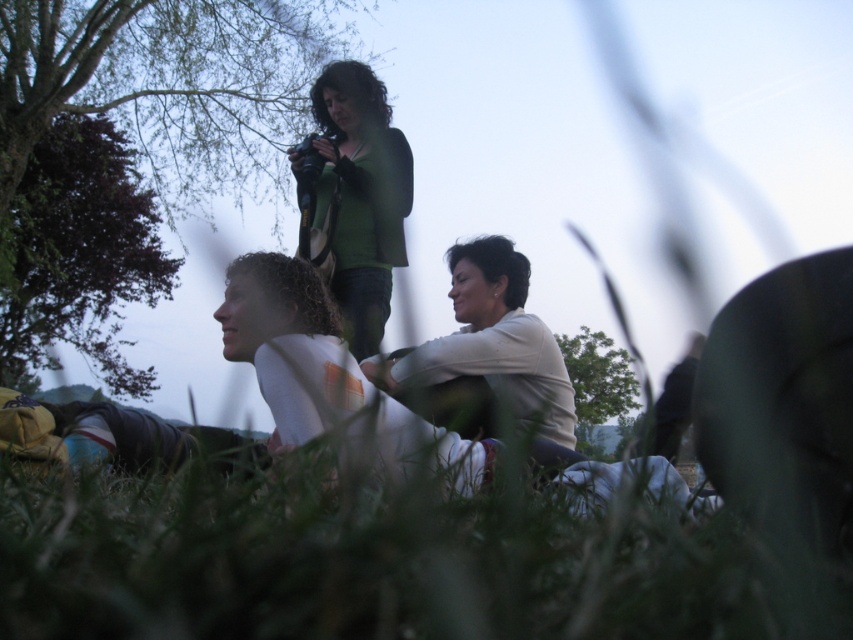
Is green grass at lower center closer to camera compared to green leafy tree at center?

Yes, it is.

Who is higher up, green grass at lower center or green leafy tree at center?

green grass at lower center is above.

Which is in front, point (444, 513) or point (577, 371)?

Point (444, 513) is in front.

This screenshot has height=640, width=853. Identify the location of green grass at lower center. (376, 563).

Between point (21, 342) and point (572, 352), which one is positioned behind?

Positioned behind is point (572, 352).

At what (x,y) coordinates should I click in order to perform the action: click on dark green leaves at upper left. Please return your answer as a coordinate pair (x, y). The height and width of the screenshot is (640, 853). Looking at the image, I should click on pyautogui.click(x=78, y=256).

At what (x,y) coordinates should I click in order to perform the action: click on dark green leaves at upper left. Please return your answer as a coordinate pair (x, y). Looking at the image, I should click on (78, 256).

The image size is (853, 640). In order to click on dark green leaves at upper left in this screenshot , I will do `click(78, 256)`.

Is green grass at lower center positioned at the back of white cotton shirt at center?

No, it is in front of white cotton shirt at center.

Is green grass at lower center shorter than white cotton shirt at center?

Yes.

Is point (257, 476) closer to camera compared to point (601, 496)?

Yes, point (257, 476) is closer to viewer.

Locate an element on the screen. The width and height of the screenshot is (853, 640). green grass at lower center is located at coordinates (376, 563).